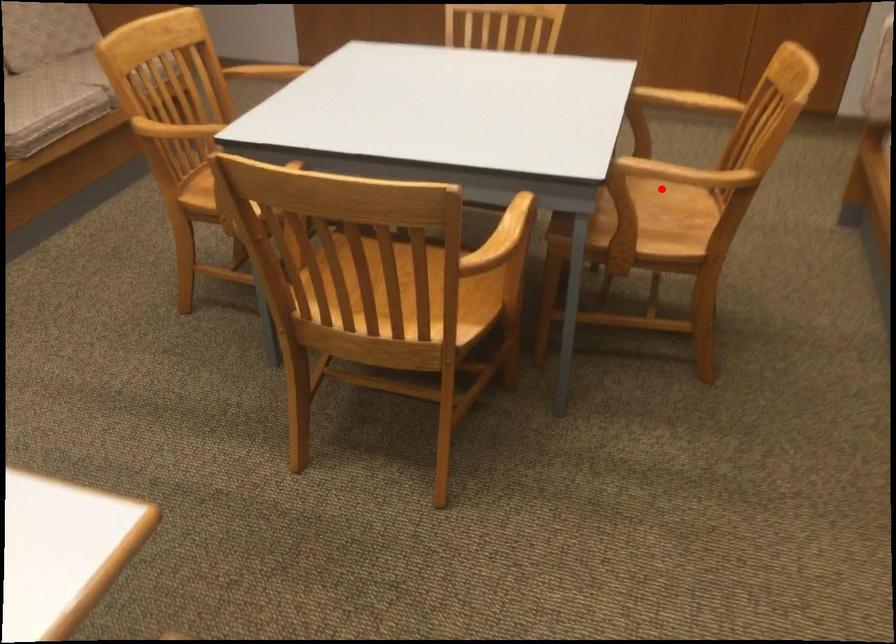
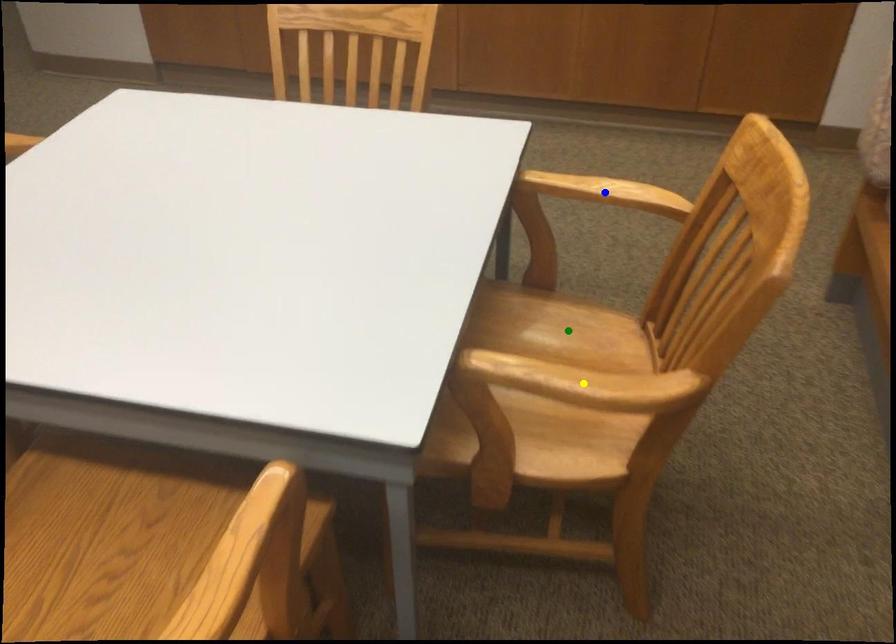
Question: I am providing you with two images of the same scene from different viewpoints. A red point is marked on the first image. You are given multiple points on the second image. Can you choose the point in image 2 that corresponds to the point in image 1?

Choices:
 (A) yellow point
 (B) green point
 (C) blue point

Answer: (B)